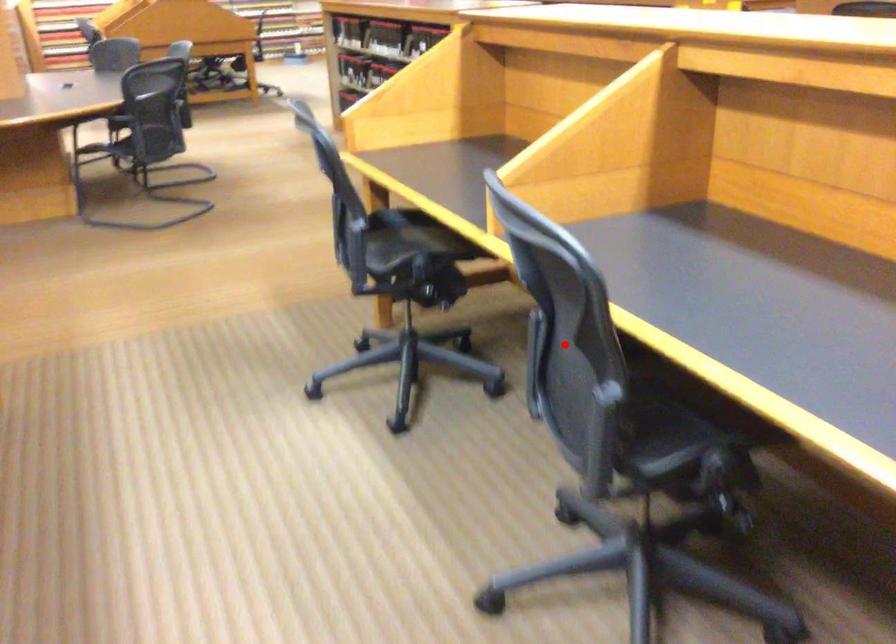
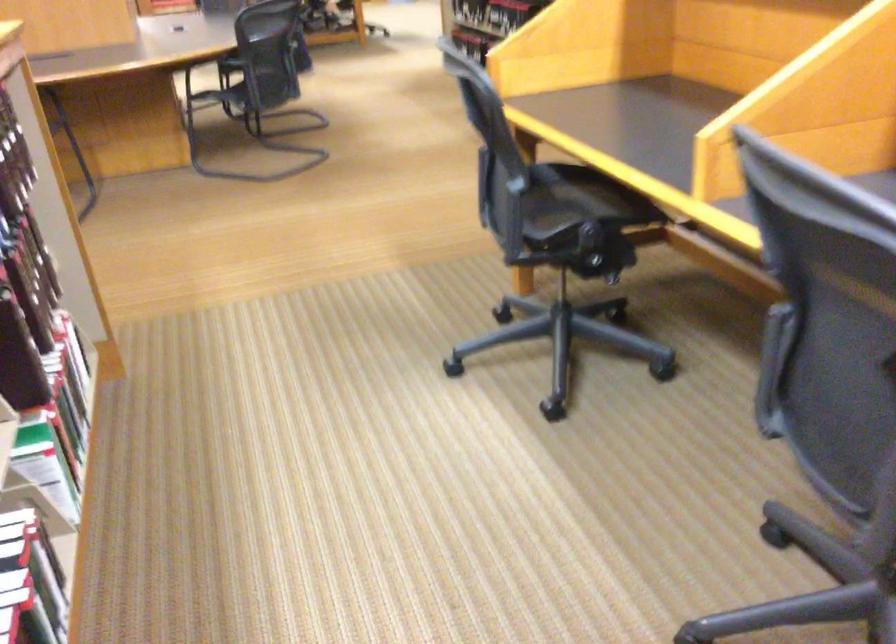
Question: I am providing you with two images of the same scene from different viewpoints. Given a red point in image1, look at the same physical point in image2. Is it:

Choices:
 (A) Closer to the viewpoint
 (B) Farther from the viewpoint

Answer: (A)